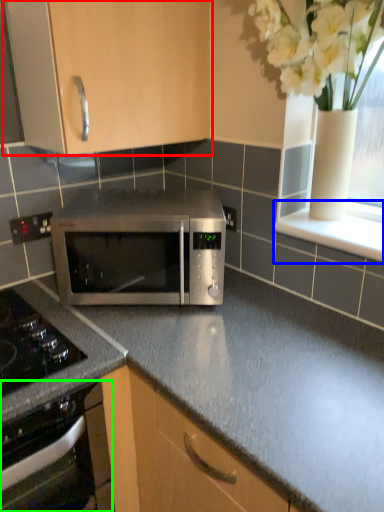
Question: Which is farther away from cabinetry (highlighted by a red box)? window sill (highlighted by a blue box) or oven (highlighted by a green box)?

Choices:
 (A) window sill
 (B) oven

Answer: (B)